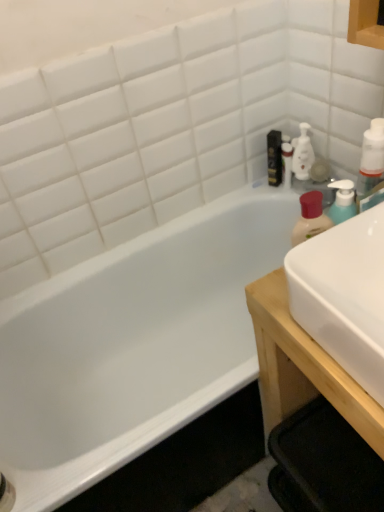
Question: From the image's perspective, would you say black glossy bottle at upper right is positioned over white glossy bottle at upper right?

Choices:
 (A) no
 (B) yes

Answer: (B)

Question: Is black glossy bottle at upper right further to the viewer compared to white glossy bottle at upper right?

Choices:
 (A) yes
 (B) no

Answer: (A)

Question: Is black glossy bottle at upper right smaller than white glossy bottle at upper right?

Choices:
 (A) yes
 (B) no

Answer: (B)

Question: Is white glossy bottle at upper right surrounded by black glossy bottle at upper right?

Choices:
 (A) yes
 (B) no

Answer: (B)

Question: From a real-world perspective, is black glossy bottle at upper right positioned over white glossy bottle at upper right based on gravity?

Choices:
 (A) yes
 (B) no

Answer: (A)

Question: Is black glossy bottle at upper right spatially inside translucent plastic bottle at upper right, or outside of it?

Choices:
 (A) inside
 (B) outside

Answer: (B)

Question: Is black glossy bottle at upper right wider or thinner than translucent plastic bottle at upper right?

Choices:
 (A) thin
 (B) wide

Answer: (B)

Question: Considering their positions, is black glossy bottle at upper right located in front of or behind translucent plastic bottle at upper right?

Choices:
 (A) behind
 (B) front

Answer: (A)

Question: Based on their sizes in the image, would you say black glossy bottle at upper right is bigger or smaller than translucent plastic bottle at upper right?

Choices:
 (A) small
 (B) big

Answer: (B)

Question: Is translucent plastic bottle at upper right to the left or to the right of white glossy bathtub at left in the image?

Choices:
 (A) right
 (B) left

Answer: (A)

Question: From the image's perspective, is translucent plastic bottle at upper right located above or below white glossy bathtub at left?

Choices:
 (A) below
 (B) above

Answer: (B)

Question: From a real-world perspective, relative to white glossy bathtub at left, is translucent plastic bottle at upper right vertically above or below?

Choices:
 (A) above
 (B) below

Answer: (A)

Question: Relative to white glossy bathtub at left, is translucent plastic bottle at upper right in front or behind?

Choices:
 (A) behind
 (B) front

Answer: (A)

Question: Is white glossy sink at right in front of or behind white plastic bottle at upper right in the image?

Choices:
 (A) behind
 (B) front

Answer: (B)

Question: Based on their sizes in the image, would you say white glossy sink at right is bigger or smaller than white plastic bottle at upper right?

Choices:
 (A) big
 (B) small

Answer: (A)